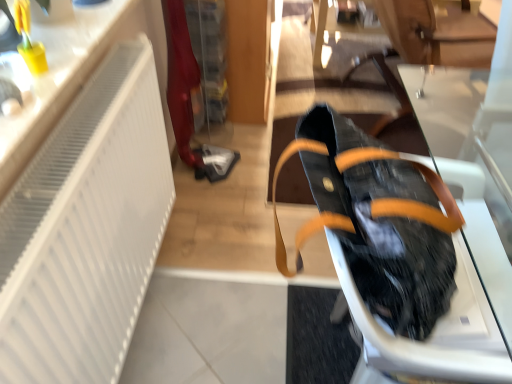
Where is `black leather bag at right`? The height and width of the screenshot is (384, 512). black leather bag at right is located at coordinates 380,218.

Image resolution: width=512 pixels, height=384 pixels. Describe the element at coordinates (380, 218) in the screenshot. I see `black leather bag at right` at that location.

The image size is (512, 384). Describe the element at coordinates (86, 229) in the screenshot. I see `white matte radiator at left` at that location.

Measure the distance between point [143,292] and camera.

Point [143,292] and camera are 4.60 feet apart from each other.

You are a GUI agent. You are given a task and a screenshot of the screen. Output one action in this format:
    pyautogui.click(x=<x>, y=<y>)
    Task: Click on the white matte radiator at left
    
    Given the screenshot: What is the action you would take?
    pyautogui.click(x=86, y=229)

The width and height of the screenshot is (512, 384). I want to click on black leather bag at right, so click(x=380, y=218).

Which is more to the left, white matte radiator at left or black leather bag at right?

From the viewer's perspective, white matte radiator at left appears more on the left side.

Which is behind, white matte radiator at left or black leather bag at right?

black leather bag at right is more distant.

Which is closer to the camera, (100, 109) or (396, 155)?

Point (100, 109) is positioned farther from the camera compared to point (396, 155).

From the image's perspective, which is below, white matte radiator at left or black leather bag at right?

white matte radiator at left is shown below in the image.

From a real-world perspective, which object stands above the other?

In real-world perspective, black leather bag at right is above.

Can you confirm if white matte radiator at left is wider than black leather bag at right?

No.

Considering the sizes of objects white matte radiator at left and black leather bag at right in the image provided, who is shorter, white matte radiator at left or black leather bag at right?

black leather bag at right is shorter.

Considering the sizes of white matte radiator at left and black leather bag at right in the image, is white matte radiator at left bigger or smaller than black leather bag at right?

In the image, white matte radiator at left appears to be larger than black leather bag at right.

Is black leather bag at right completely or partially inside white matte radiator at left?

No, black leather bag at right is not surrounded by white matte radiator at left.

Is white matte radiator at left directly adjacent to black leather bag at right?

They are not placed beside each other.

Is white matte radiator at left turned away from black leather bag at right?

That's not correct — white matte radiator at left is not looking away from black leather bag at right.

Locate an element on the screen. This screenshot has width=512, height=384. radiator below the black leather bag at right (from a real-world perspective) is located at coordinates point(86,229).

Which is more to the right, black leather bag at right or white matte radiator at left?

black leather bag at right.

Does black leather bag at right lie behind white matte radiator at left?

That is True.

Does point (395, 270) appear closer or farther from the camera than point (29, 240)?

Point (395, 270) is closer to the camera than point (29, 240).

Based on the photo, from the image's perspective, who appears lower, black leather bag at right or white matte radiator at left?

white matte radiator at left is shown below in the image.

From a real-world perspective, is black leather bag at right located higher than white matte radiator at left?

Yes, from a real-world perspective, black leather bag at right is on top of white matte radiator at left.

Which of these two, black leather bag at right or white matte radiator at left, is thinner?

white matte radiator at left is thinner.

Considering the sizes of objects black leather bag at right and white matte radiator at left in the image provided, who is shorter, black leather bag at right or white matte radiator at left?

With less height is black leather bag at right.

Who is bigger, black leather bag at right or white matte radiator at left?

Bigger between the two is white matte radiator at left.

Is black leather bag at right positioned beyond the bounds of white matte radiator at left?

Absolutely, black leather bag at right is external to white matte radiator at left.

Can you see black leather bag at right touching white matte radiator at left?

No, black leather bag at right is not making contact with white matte radiator at left.

Is black leather bag at right looking in the opposite direction of white matte radiator at left?

That's right, black leather bag at right is facing away from white matte radiator at left.

What's the angular difference between black leather bag at right and white matte radiator at left's facing directions?

6.48 degrees separate the facing orientations of black leather bag at right and white matte radiator at left.

How distant is black leather bag at right from white matte radiator at left?

black leather bag at right is 19.57 inches from white matte radiator at left.

Identify the location of radiator that appears on the left of black leather bag at right. (86, 229).

The image size is (512, 384). I want to click on radiator below the black leather bag at right (from a real-world perspective), so click(86, 229).

Image resolution: width=512 pixels, height=384 pixels. In the image, there is a black leather bag at right. Find the location of `radiator below it (from the image's perspective)`. radiator below it (from the image's perspective) is located at coordinates (86, 229).